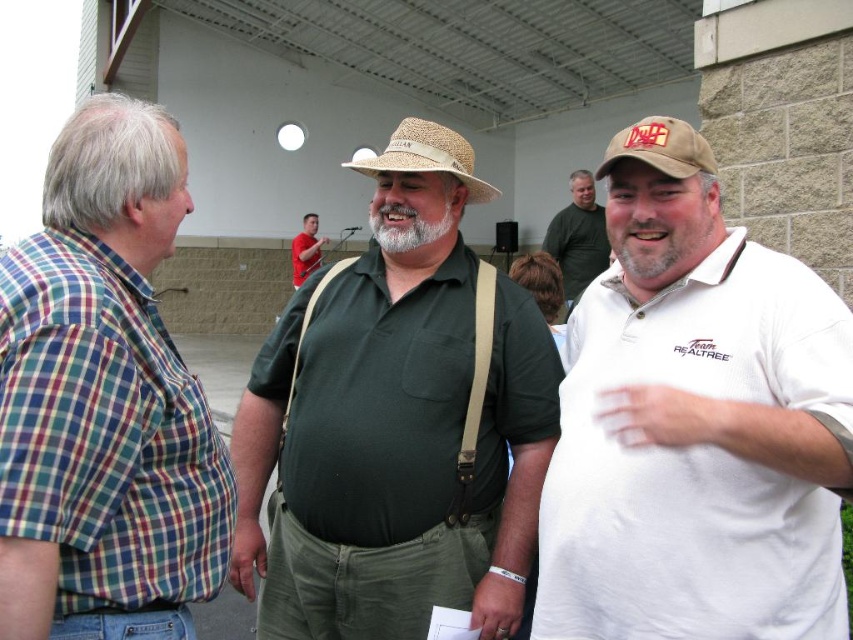
Can you confirm if plaid shirt at left is positioned to the left of tan straw cowboy hat at center?

Yes, plaid shirt at left is to the left of tan straw cowboy hat at center.

Can you confirm if plaid shirt at left is shorter than tan straw cowboy hat at center?

Incorrect, plaid shirt at left's height does not fall short of tan straw cowboy hat at center's.

Is point (106, 404) farther from viewer compared to point (694, 163)?

No, it is not.

The width and height of the screenshot is (853, 640). What are the coordinates of `plaid shirt at left` in the screenshot? It's located at (103, 400).

Between green matte shirt at center and tan straw cowboy hat at center, which one is positioned lower?

Positioned lower is green matte shirt at center.

Is point (430, 250) less distant than point (671, 161)?

No.

This screenshot has width=853, height=640. In order to click on green matte shirt at center in this screenshot , I will do `click(396, 429)`.

Does white cotton shirt at upper right appear over red cotton shirt at center?

Incorrect, white cotton shirt at upper right is not positioned above red cotton shirt at center.

Can you confirm if white cotton shirt at upper right is wider than red cotton shirt at center?

Correct, the width of white cotton shirt at upper right exceeds that of red cotton shirt at center.

Where is `white cotton shirt at upper right`? This screenshot has width=853, height=640. white cotton shirt at upper right is located at coordinates (578, 236).